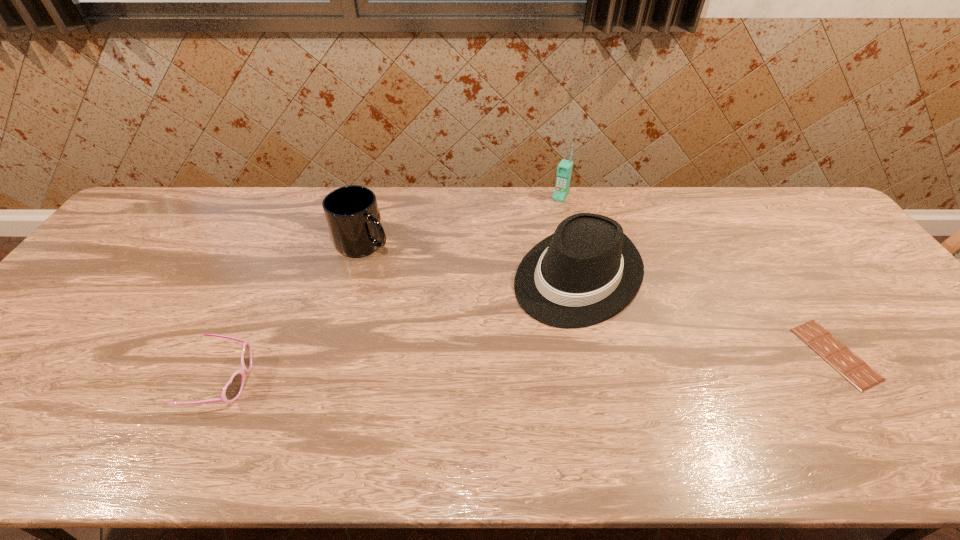
Locate an element on the screen. vacant spot on the desktop that is between the second shortest object and the shortest object and is positioned on the front-facing side of the fedora is located at coordinates (479, 370).

You are a GUI agent. You are given a task and a screenshot of the screen. Output one action in this format:
    pyautogui.click(x=<x>, y=<y>)
    Task: Click on the free space on the desktop that is between the leftmost object and the chocolate bar and is positioned on the keypad of the tallest object
    The height and width of the screenshot is (540, 960).
    Given the screenshot: What is the action you would take?
    pyautogui.click(x=446, y=371)

At what (x,y) coordinates should I click in order to perform the action: click on free space on the desktop that is between the sunglasses and the rightmost object and is positioned with the handle on the side of the mug. Please return your answer as a coordinate pair (x, y). Looking at the image, I should click on (488, 369).